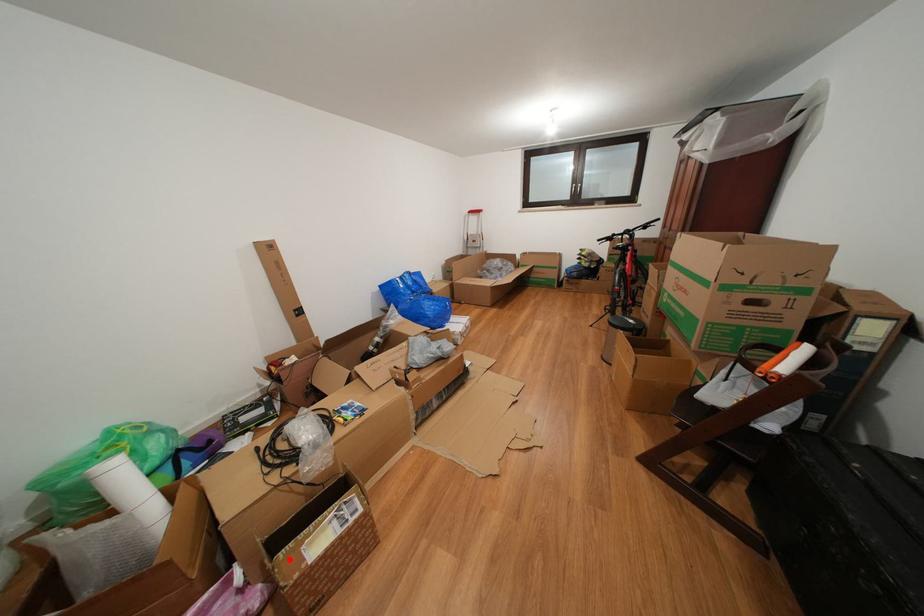
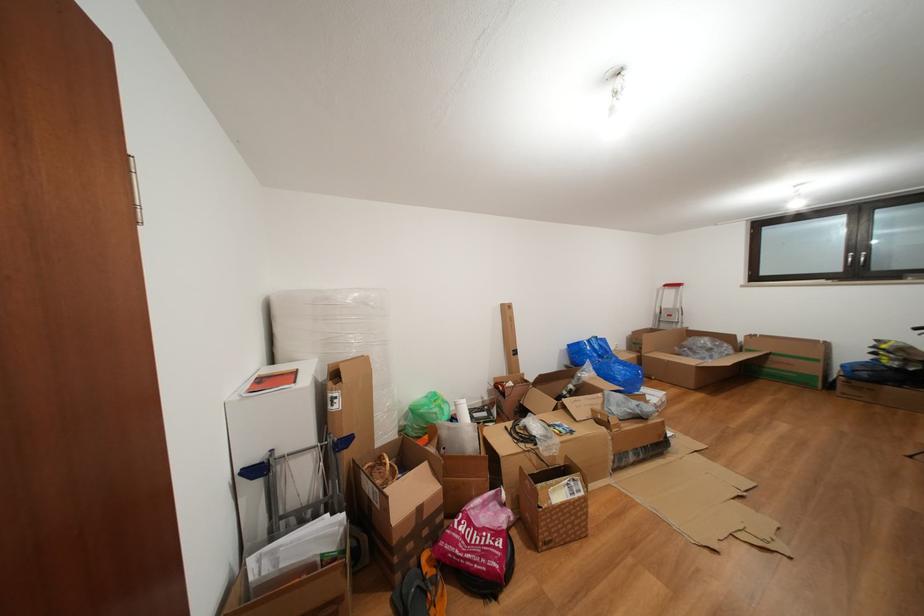
Question: I am providing you with two images of the same scene from different viewpoints. Image1 has a red point marked. In image2, the corresponding 3D location appears at what relative position? Reply with the corresponding letter.

Choices:
 (A) Closer
 (B) Farther

Answer: (A)